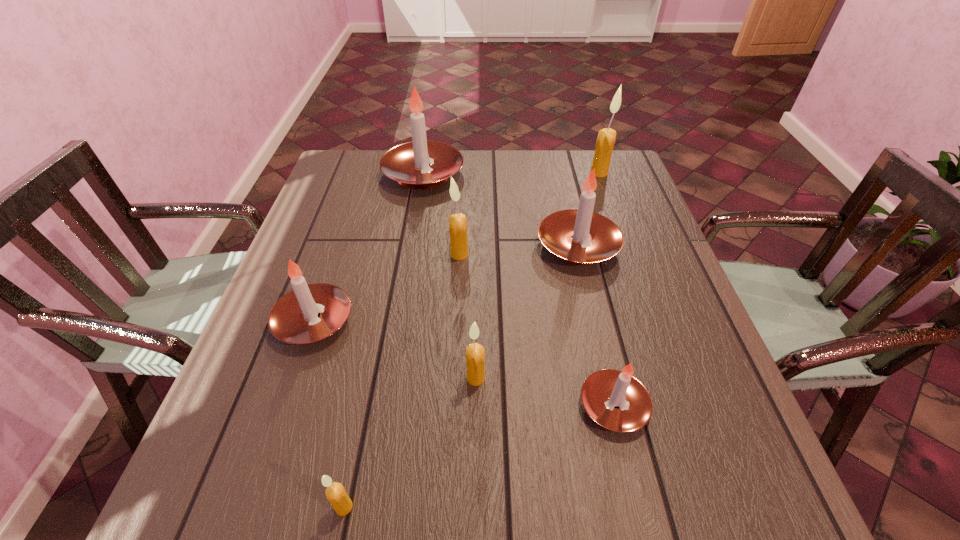
This screenshot has height=540, width=960. In order to click on candle that is the second closest one to the second nearest white candle in this screenshot , I will do `click(475, 353)`.

Select which candle is the fifth closest to the rightmost cream candle. Please provide its 2D coordinates. Your answer should be formatted as a tuple, i.e. [(x, y)], where the tuple contains the x and y coordinates of a point satisfying the conditions above.

[(475, 353)]

Identify which white candle is located as the fourth nearest to the farthest cream candle. Please provide its 2D coordinates. Your answer should be formatted as a tuple, i.e. [(x, y)], where the tuple contains the x and y coordinates of a point satisfying the conditions above.

[(293, 319)]

Identify the location of white candle that is the third nearest to the third farthest white candle. The width and height of the screenshot is (960, 540). (603, 390).

Image resolution: width=960 pixels, height=540 pixels. I want to click on cream candle that is the fourth closest one to the smallest white candle, so click(x=605, y=142).

Select which cream candle appears as the closest to the third cream candle from right to left. Please provide its 2D coordinates. Your answer should be formatted as a tuple, i.e. [(x, y)], where the tuple contains the x and y coordinates of a point satisfying the conditions above.

[(475, 353)]

Image resolution: width=960 pixels, height=540 pixels. In order to click on free space in the image that satisfies the following two spatial constraints: 1. on the back side of the biggest cream candle; 2. on the right side of the second farthest white candle in this screenshot , I will do 561,173.

At what (x,y) coordinates should I click in order to perform the action: click on free location that satisfies the following two spatial constraints: 1. on the back side of the third smallest white candle; 2. on the left side of the third farthest white candle. Please return your answer as a coordinate pair (x, y). Looking at the image, I should click on (340, 246).